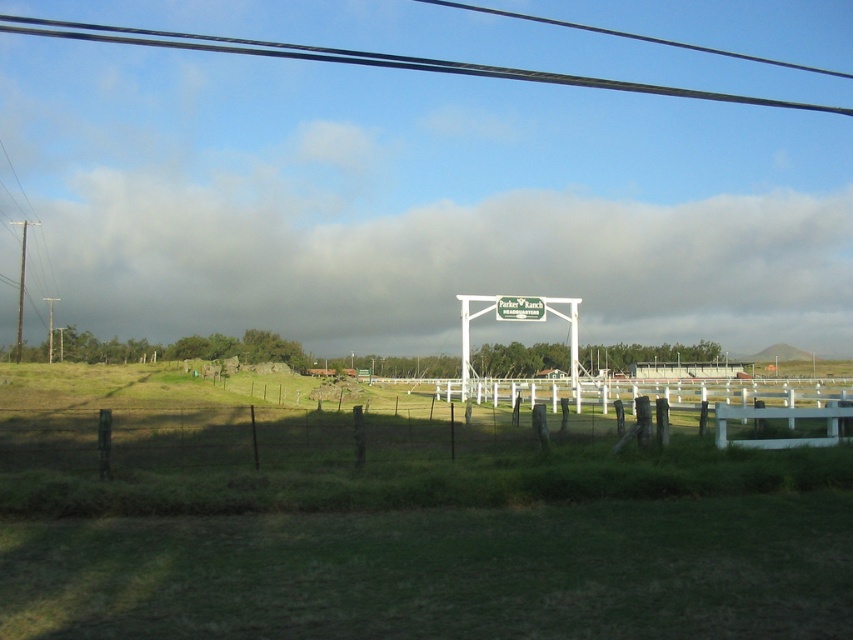
Can you confirm if cloudy sky at upper center is wider than green plastic sign at center?

Indeed, cloudy sky at upper center has a greater width compared to green plastic sign at center.

Is the position of cloudy sky at upper center more distant than that of green plastic sign at center?

Yes.

Is point (183, 285) positioned in front of point (508, 310)?

No.

Find the location of a particular element. The image size is (853, 640). cloudy sky at upper center is located at coordinates (421, 243).

Who is higher up, wooden fence at lower center or black wire at upper center?

black wire at upper center

Who is lower down, wooden fence at lower center or black wire at upper center?

wooden fence at lower center

Locate an element on the screen. wooden fence at lower center is located at coordinates (329, 440).

Can you confirm if cloudy sky at upper center is wider than wooden fence at lower center?

Indeed, cloudy sky at upper center has a greater width compared to wooden fence at lower center.

Is cloudy sky at upper center below wooden fence at lower center?

No.

Does point (228, 308) come in front of point (71, 420)?

No, (228, 308) is further to viewer.

Where is `cloudy sky at upper center`? The width and height of the screenshot is (853, 640). cloudy sky at upper center is located at coordinates (421, 243).